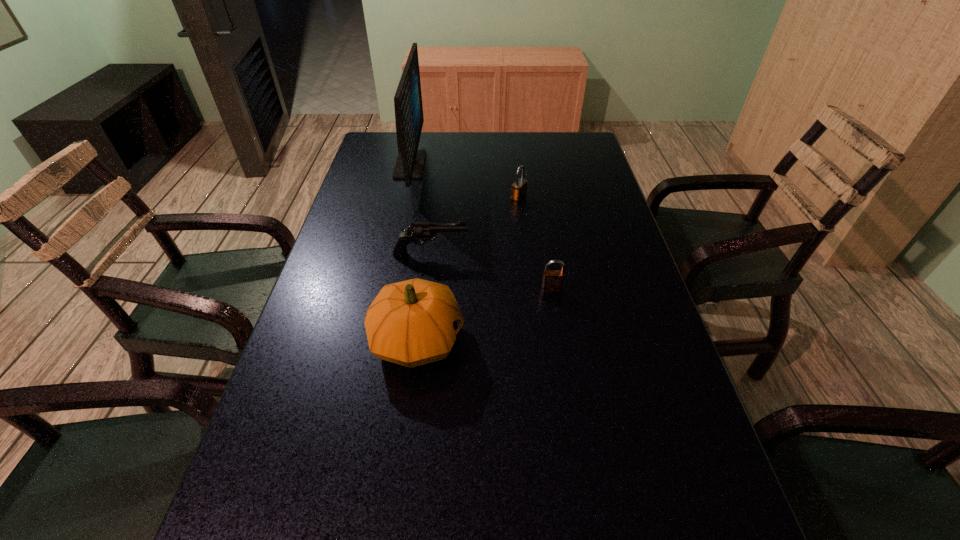
Identify the location of vacant space located on the front of the farther padlock. Image resolution: width=960 pixels, height=540 pixels. point(528,285).

Find the location of a particular element. free location located 0.260m at the end of the barrel of the third nearest object is located at coordinates (572, 254).

Image resolution: width=960 pixels, height=540 pixels. In order to click on vacant space located on the front-facing side of the nearer padlock in this screenshot , I will do `click(571, 406)`.

This screenshot has height=540, width=960. In order to click on object located at the far edge in this screenshot , I will do `click(409, 119)`.

Where is `computer monitor that is at the left edge`? The image size is (960, 540). computer monitor that is at the left edge is located at coordinates (409, 119).

In order to click on gourd that is at the left edge in this screenshot , I will do `click(414, 322)`.

At what (x,y) coordinates should I click in order to perform the action: click on object at the far left corner. Please return your answer as a coordinate pair (x, y). The image size is (960, 540). Looking at the image, I should click on (409, 119).

This screenshot has height=540, width=960. In order to click on blank area at the far edge in this screenshot , I will do `click(477, 162)`.

Where is `vacant area at the left edge`? Image resolution: width=960 pixels, height=540 pixels. vacant area at the left edge is located at coordinates (334, 332).

In the image, there is a desktop. Where is `vacant space at the right edge`? vacant space at the right edge is located at coordinates (599, 204).